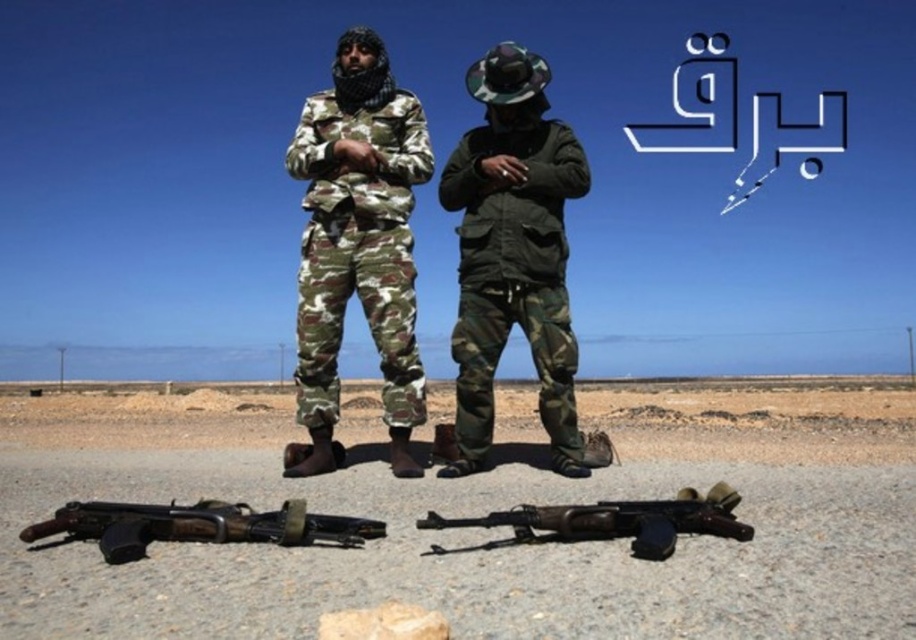
Question: Estimate the real-world distances between objects in this image. Which object is closer to the rusty metal rifle at lower center?

Choices:
 (A) dull gray gravel at center
 (B) matte black rifle at lower center

Answer: (B)

Question: Among these points, which one is nearest to the camera?

Choices:
 (A) (871, 570)
 (B) (658, 548)
 (C) (344, 125)
 (D) (40, 529)

Answer: (A)

Question: Which object is closer to the camera taking this photo?

Choices:
 (A) camo fabric uniform at center
 (B) matte black rifle at lower center

Answer: (B)

Question: Does dark green matte jacket at center lie in front of rusty metal rifle at lower center?

Choices:
 (A) yes
 (B) no

Answer: (B)

Question: Is the position of dark green matte jacket at center more distant than that of matte black rifle at lower center?

Choices:
 (A) no
 (B) yes

Answer: (B)

Question: Is dull gray gravel at center wider than rusty metal rifle at lower center?

Choices:
 (A) no
 (B) yes

Answer: (B)